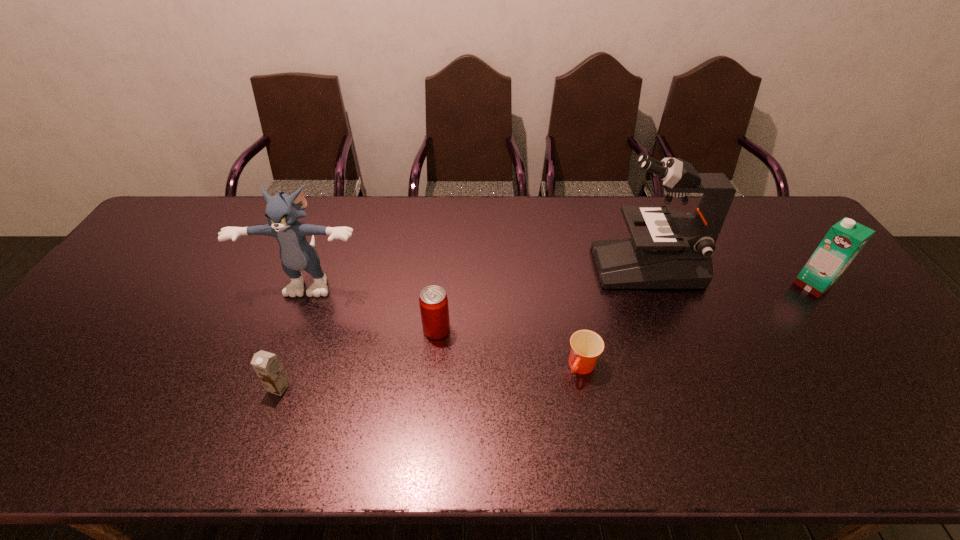
Where is `free area in between the second tallest object and the can`? The width and height of the screenshot is (960, 540). free area in between the second tallest object and the can is located at coordinates (374, 303).

Identify the location of free space between the second object from right to left and the can. The height and width of the screenshot is (540, 960). (541, 298).

Locate an element on the screen. The width and height of the screenshot is (960, 540). object that stands as the second closest to the third object from right to left is located at coordinates (433, 301).

The width and height of the screenshot is (960, 540). In order to click on the third closest object to the fourth shortest object in this screenshot , I will do `click(433, 301)`.

Identify the location of vacant space that satisfies the following two spatial constraints: 1. on the front-facing side of the cat; 2. on the left side of the fourth farthest object. (293, 329).

Locate an element on the screen. This screenshot has width=960, height=540. vacant space that satisfies the following two spatial constraints: 1. on the front-facing side of the can; 2. on the right side of the cat is located at coordinates (293, 329).

Find the location of a particular element. vacant space that satisfies the following two spatial constraints: 1. through the eyepieces of the second object from right to left; 2. on the back side of the third tallest object is located at coordinates (653, 285).

The image size is (960, 540). I want to click on vacant area that satisfies the following two spatial constraints: 1. on the front-facing side of the second tallest object; 2. on the left side of the fourth object from right to left, so coord(293,329).

This screenshot has height=540, width=960. Identify the location of free location that satisfies the following two spatial constraints: 1. on the front-facing side of the fifth shortest object; 2. on the left side of the can. (293, 329).

Where is `vacant point that satisfies the following two spatial constraints: 1. on the front-facing side of the rightmost object; 2. on the left side of the fifth shortest object`? vacant point that satisfies the following two spatial constraints: 1. on the front-facing side of the rightmost object; 2. on the left side of the fifth shortest object is located at coordinates (310, 285).